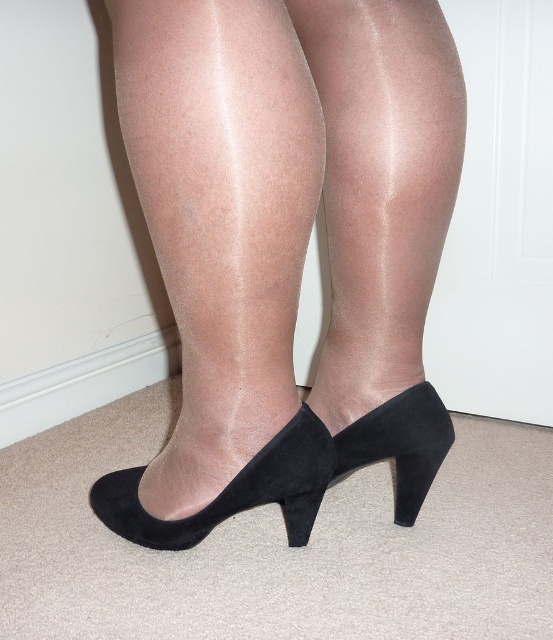
You are taking a photo of a model wearing sheer pantyhose and black suede high heels. You notice two points marked as point (254, 289) and point (317, 468). Which point is closer to the camera?

Point (254, 289) is closer to the camera than point (317, 468).